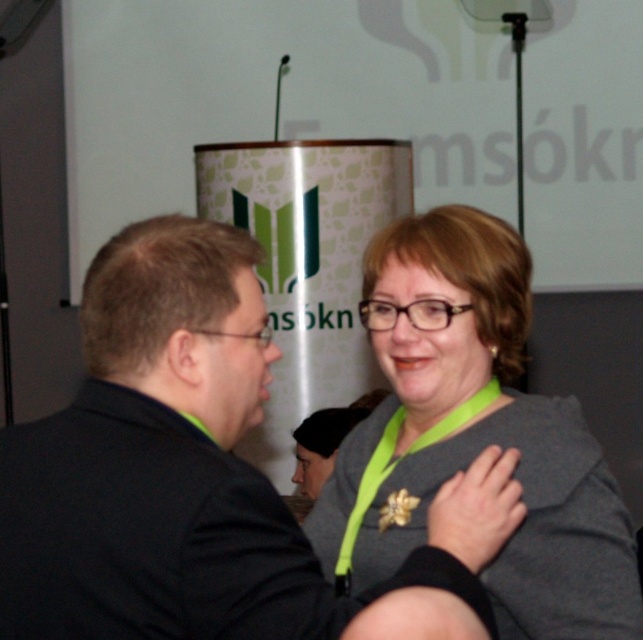
Question: Which of the following is the closest to the observer?

Choices:
 (A) black matte suit at center
 (B) gray matte jacket at center

Answer: (A)

Question: Is black matte suit at center above gray matte jacket at center?

Choices:
 (A) yes
 (B) no

Answer: (A)

Question: Does black matte suit at center lie in front of gray matte jacket at center?

Choices:
 (A) no
 (B) yes

Answer: (B)

Question: Is black matte suit at center to the right of gray matte jacket at center from the viewer's perspective?

Choices:
 (A) no
 (B) yes

Answer: (A)